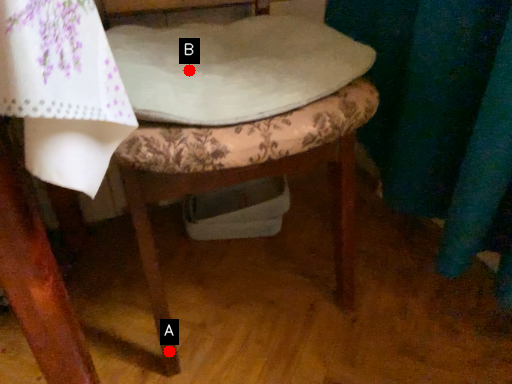
Question: Two points are circled on the image, labeled by A and B beside each circle. Which point is farther to the camera?

Choices:
 (A) A is further
 (B) B is further

Answer: (A)